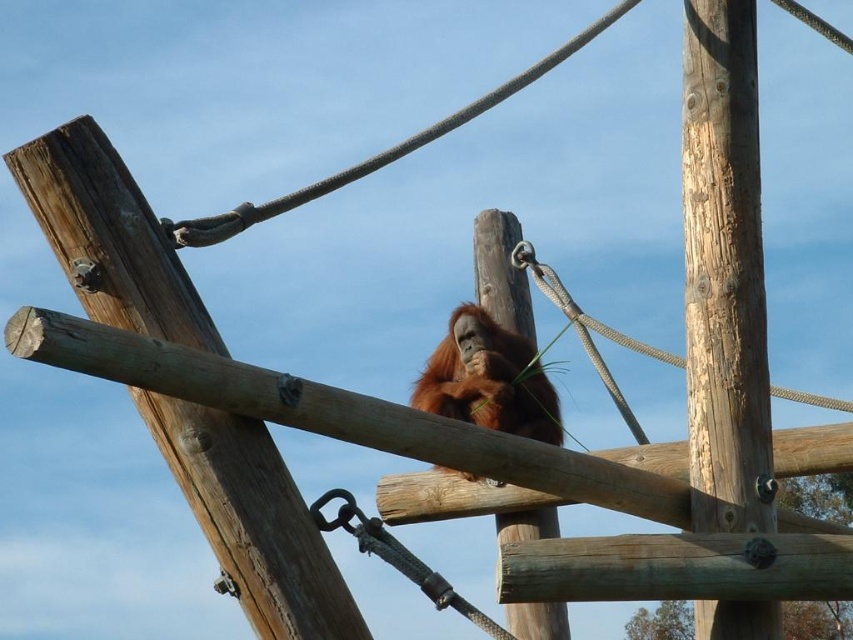
Is point (740, 326) closer to viewer compared to point (440, 364)?

Yes, it is.

Is point (737, 628) in front of point (521, 385)?

Yes, it is in front of point (521, 385).

Find the location of a particular element. This screenshot has width=853, height=640. weathered wood pole at center is located at coordinates (724, 272).

Who is taller, orange fur orangutan at center or smooth wood pole at center?

smooth wood pole at center

This screenshot has width=853, height=640. In order to click on orange fur orangutan at center in this screenshot , I will do `click(488, 380)`.

Which of these two, rustic wood pole at center or orange fur orangutan at center, stands taller?

With more height is rustic wood pole at center.

Can you confirm if rustic wood pole at center is positioned above orange fur orangutan at center?

Yes.

Which is in front, point (181, 406) or point (456, 404)?

Point (181, 406) is more forward.

Locate an element on the screen. rustic wood pole at center is located at coordinates (252, 518).